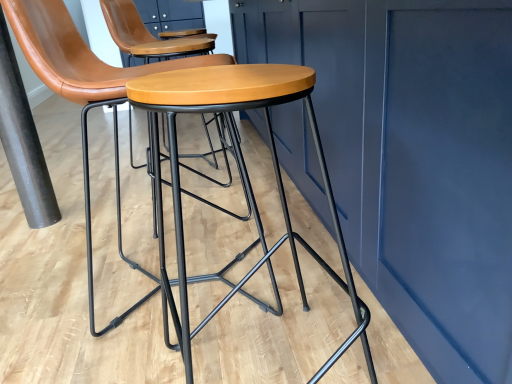
Question: Considering the relative positions of matte black stool at center and black matte pole at left in the image provided, is matte black stool at center to the left or to the right of black matte pole at left?

Choices:
 (A) left
 (B) right

Answer: (B)

Question: Considering the positions of matte black stool at center and black matte pole at left in the image, is matte black stool at center bigger or smaller than black matte pole at left?

Choices:
 (A) small
 (B) big

Answer: (B)

Question: Which of these objects is positioned closest to the matte black stool at center?

Choices:
 (A) wooden/matte stool at center
 (B) black matte pole at left

Answer: (A)

Question: Estimate the real-world distances between objects in this image. Which object is closer to the matte black stool at center?

Choices:
 (A) wooden/matte stool at center
 (B) black matte pole at left

Answer: (A)